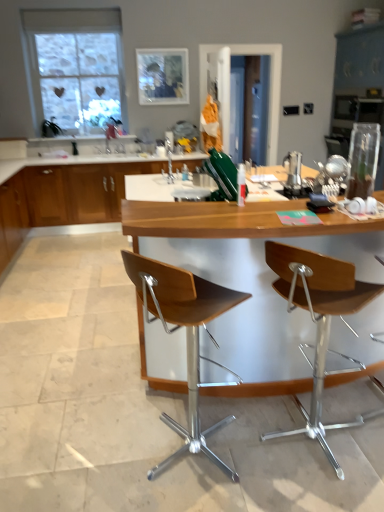
Question: Can you confirm if wooden seat at center, the first chair viewed from the left, is positioned to the left of wooden seat at right, the 1th chair in the right-to-left sequence?

Choices:
 (A) no
 (B) yes

Answer: (B)

Question: Is wooden seat at center, the first chair viewed from the left, facing away from wooden seat at right, the 2th chair from the left?

Choices:
 (A) yes
 (B) no

Answer: (B)

Question: From a real-world perspective, is wooden seat at center, arranged as the second chair when viewed from the right, located beneath wooden seat at right, the 1th chair in the right-to-left sequence?

Choices:
 (A) no
 (B) yes

Answer: (B)

Question: Can you confirm if wooden seat at center, arranged as the second chair when viewed from the right, is taller than wooden seat at right, the 2th chair from the left?

Choices:
 (A) yes
 (B) no

Answer: (A)

Question: From the image's perspective, is wooden seat at center, the first chair viewed from the left, below wooden seat at right, the 1th chair in the right-to-left sequence?

Choices:
 (A) yes
 (B) no

Answer: (A)

Question: Is wooden seat at right, the 1th chair in the right-to-left sequence, a part of wooden seat at center, the first chair viewed from the left?

Choices:
 (A) no
 (B) yes

Answer: (A)

Question: Considering the relative sizes of wooden seat at center, the first chair viewed from the left, and clear glass window at upper left in the image provided, is wooden seat at center, the first chair viewed from the left, shorter than clear glass window at upper left?

Choices:
 (A) no
 (B) yes

Answer: (B)

Question: Are wooden seat at center, the first chair viewed from the left, and clear glass window at upper left making contact?

Choices:
 (A) yes
 (B) no

Answer: (B)

Question: Is wooden seat at center, the first chair viewed from the left, facing away from clear glass window at upper left?

Choices:
 (A) no
 (B) yes

Answer: (A)

Question: Is wooden seat at center, arranged as the second chair when viewed from the right, not close to clear glass window at upper left?

Choices:
 (A) yes
 (B) no

Answer: (A)

Question: Could clear glass window at upper left be considered to be inside wooden seat at center, the first chair viewed from the left?

Choices:
 (A) yes
 (B) no

Answer: (B)

Question: Can you confirm if wooden seat at center, the first chair viewed from the left, is positioned to the right of clear glass window at upper left?

Choices:
 (A) yes
 (B) no

Answer: (A)

Question: Is the depth of wooden cabinet at center greater than that of wooden seat at right, the 2th chair from the left?

Choices:
 (A) yes
 (B) no

Answer: (A)